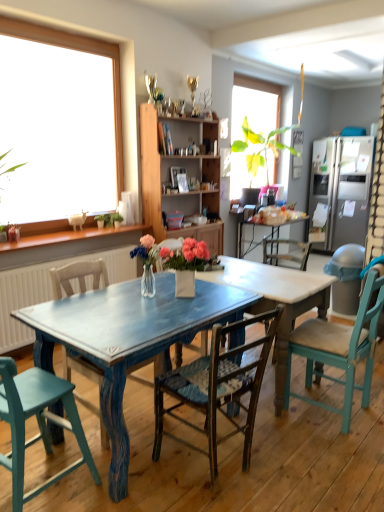
What do you see at coordinates (217, 389) in the screenshot? I see `wooden woven seat chair at center, the third chair viewed from the left` at bounding box center [217, 389].

Image resolution: width=384 pixels, height=512 pixels. Describe the element at coordinates (339, 350) in the screenshot. I see `teal wood chair at right, which is the fourth chair in left-to-right order` at that location.

This screenshot has width=384, height=512. What do you see at coordinates (182, 183) in the screenshot? I see `wooden picture frame at center` at bounding box center [182, 183].

What is the approximate height of satin silver refrigerator at right?

satin silver refrigerator at right is 6.01 feet tall.

Locate an element on the screen. Image resolution: width=384 pixels, height=512 pixels. satin silver refrigerator at right is located at coordinates (343, 188).

This screenshot has width=384, height=512. What are the coordinates of `wooden woven seat chair at center, the third chair viewed from the left` in the screenshot? It's located at (217, 389).

Is wooden picture frame at center surrounding distressed blue table at center?

Definitely not — distressed blue table at center is not inside wooden picture frame at center.

Is wooden picture frame at center placed right next to distressed blue table at center?

No, wooden picture frame at center is not making contact with distressed blue table at center.

Can you tell me how much wooden picture frame at center and distressed blue table at center differ in facing direction?

They differ by 8.3 degrees in their facing directions.

Does wooden picture frame at center appear on the left side of distressed blue table at center?

Yes, wooden picture frame at center is to the left of distressed blue table at center.

Between blue distressed wood table at center and wooden picture frame at center, which one has more height?

With more height is wooden picture frame at center.

Would you consider blue distressed wood table at center to be distant from wooden picture frame at center?

That's right, there is a large distance between blue distressed wood table at center and wooden picture frame at center.

Can you confirm if blue distressed wood table at center is thinner than wooden picture frame at center?

Incorrect, the width of blue distressed wood table at center is not less than that of wooden picture frame at center.

Based on their sizes in the image, would you say blue distressed wood table at center is bigger or smaller than wooden picture frame at center?

blue distressed wood table at center is bigger than wooden picture frame at center.

Would you say wooden chair at left, the second chair when ordered from left to right, is to the left or to the right of distressed blue table at center in the picture?

wooden chair at left, the second chair when ordered from left to right, is positioned on distressed blue table at center's left side.

Is wooden chair at left, the second chair when ordered from left to right, inside or outside of distressed blue table at center?

wooden chair at left, the second chair when ordered from left to right, is not inside distressed blue table at center, it's outside.

Find the location of a particular element. This screenshot has width=384, height=512. table above the wooden chair at left, the 3th chair viewed from the right (from the image's perspective) is located at coordinates (276, 301).

Considering the positions of points (92, 408) and (272, 267), is point (92, 408) farther from camera compared to point (272, 267)?

No, it is not.

From the picture: Which object is wider, wooden woven seat chair at center, the third chair viewed from the left, or teal painted wood chair at lower left, the first chair from the left?

With larger width is wooden woven seat chair at center, the third chair viewed from the left.

Measure the distance from wooden woven seat chair at center, the third chair viewed from the left, to teal painted wood chair at lower left, the first chair from the left.

24.52 inches.

Who is shorter, wooden woven seat chair at center, the third chair viewed from the left, or teal painted wood chair at lower left, which appears as the 4th chair when viewed from the right?

With less height is teal painted wood chair at lower left, which appears as the 4th chair when viewed from the right.

Is wooden woven seat chair at center, the third chair viewed from the left, at the left side of teal painted wood chair at lower left, which appears as the 4th chair when viewed from the right?

In fact, wooden woven seat chair at center, the third chair viewed from the left, is to the right of teal painted wood chair at lower left, which appears as the 4th chair when viewed from the right.

Can you confirm if wooden chair at left, the 3th chair viewed from the right, is thinner than wooden woven seat chair at center, the second chair viewed from the right?

In fact, wooden chair at left, the 3th chair viewed from the right, might be wider than wooden woven seat chair at center, the second chair viewed from the right.

Between wooden chair at left, the 3th chair viewed from the right, and wooden woven seat chair at center, the third chair viewed from the left, which one appears on the right side from the viewer's perspective?

From the viewer's perspective, wooden woven seat chair at center, the third chair viewed from the left, appears more on the right side.

Looking at this image, who is shorter, wooden chair at left, the second chair when ordered from left to right, or wooden woven seat chair at center, the second chair viewed from the right?

wooden woven seat chair at center, the second chair viewed from the right, is shorter.

The width and height of the screenshot is (384, 512). In order to click on desk below the wooden picture frame at center (from the image's perspective) in this screenshot , I will do `click(164, 330)`.

Looking at this image, measure the distance from wooden picture frame at center to blue distressed wood table at center.

wooden picture frame at center is 2.23 meters from blue distressed wood table at center.

Does wooden picture frame at center appear on the right side of blue distressed wood table at center?

No.

Which of these two, wooden picture frame at center or blue distressed wood table at center, stands taller?

wooden picture frame at center.

Are wooden chair at left, the second chair when ordered from left to right, and blue distressed wood table at center beside each other?

No, wooden chair at left, the second chair when ordered from left to right, is not making contact with blue distressed wood table at center.

Consider the image. Considering the relative sizes of wooden chair at left, the second chair when ordered from left to right, and blue distressed wood table at center in the image provided, is wooden chair at left, the second chair when ordered from left to right, thinner than blue distressed wood table at center?

Yes.

Between point (67, 358) and point (39, 318), which one is positioned behind?

The point (67, 358) is farther.

This screenshot has width=384, height=512. I want to click on table below the wooden picture frame at center (from the image's perspective), so click(276, 301).

There is a blue distressed wood table at center. Where is `picture frame above it (from a real-world perspective)`? Image resolution: width=384 pixels, height=512 pixels. picture frame above it (from a real-world perspective) is located at coordinates (182, 183).

Looking at the image, which one is located further to teal painted wood chair at lower left, the first chair from the left, satin silver refrigerator at right or wooden chair at left, the second chair when ordered from left to right?

satin silver refrigerator at right is positioned further to the anchor teal painted wood chair at lower left, the first chair from the left.

Considering their positions, is wooden woven seat chair at center, the second chair viewed from the right, positioned closer to wooden cabinet at center than blue distressed wood table at center?

Among the two, blue distressed wood table at center is located nearer to wooden cabinet at center.

Looking at the image, which one is located closer to teal painted wood chair at lower left, the first chair from the left, wooden chair at left, the 3th chair viewed from the right, or wooden cabinet at center?

wooden chair at left, the 3th chair viewed from the right, lies closer to teal painted wood chair at lower left, the first chair from the left, than the other object.

Based on their spatial positions, is satin silver refrigerator at right or distressed blue table at center further from wooden picture frame at center?

The object further to wooden picture frame at center is satin silver refrigerator at right.

Based on their spatial positions, is teal painted wood chair at lower left, which appears as the 4th chair when viewed from the right, or wooden cabinet at center further from blue distressed wood table at center?

The object further to blue distressed wood table at center is wooden cabinet at center.

When comparing their distances from wooden cabinet at center, does wooden chair at left, the 3th chair viewed from the right, or wooden picture frame at center seem further?

Based on the image, wooden chair at left, the 3th chair viewed from the right, appears to be further to wooden cabinet at center.

Looking at the image, which one is located closer to teal wood chair at right, the 1th chair positioned from the right, satin silver refrigerator at right or wooden chair at left, the 3th chair viewed from the right?

wooden chair at left, the 3th chair viewed from the right.

Based on their spatial positions, is wooden cabinet at center or wooden woven seat chair at center, the third chair viewed from the left, further from teal wood chair at right, the 1th chair positioned from the right?

Among the two, wooden cabinet at center is located further to teal wood chair at right, the 1th chair positioned from the right.

At what (x,y) coordinates should I click in order to perform the action: click on cabinetry located between distressed blue table at center and wooden picture frame at center in the depth direction. Please return your answer as a coordinate pair (x, y). This screenshot has height=512, width=384. Looking at the image, I should click on (187, 173).

The width and height of the screenshot is (384, 512). Find the location of `table positioned between wooden woven seat chair at center, the second chair viewed from the right, and satin silver refrigerator at right from near to far`. table positioned between wooden woven seat chair at center, the second chair viewed from the right, and satin silver refrigerator at right from near to far is located at coordinates (276, 301).

Where is `table positioned between wooden chair at left, the 3th chair viewed from the right, and satin silver refrigerator at right from near to far`? This screenshot has height=512, width=384. table positioned between wooden chair at left, the 3th chair viewed from the right, and satin silver refrigerator at right from near to far is located at coordinates (276, 301).

This screenshot has width=384, height=512. Identify the location of cabinetry between teal wood chair at right, the 1th chair positioned from the right, and satin silver refrigerator at right in the front-back direction. (187, 173).